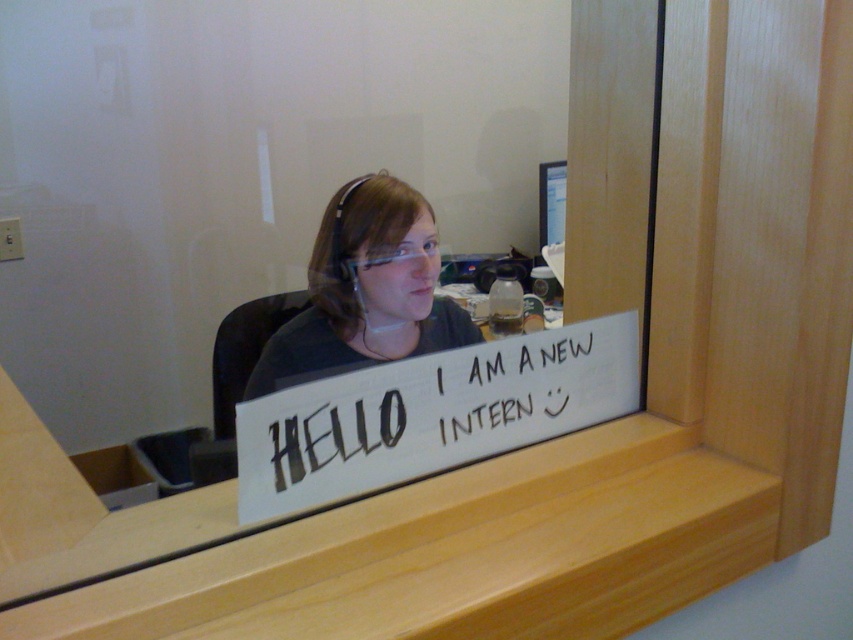
Where is the white paper sign at center located in the image?

The white paper sign at center is located at point (428, 413) in the image.

You are an office manager inspecting the desk of a new intern. You notice the matte black shirt at center and the clear plastic goggles at center on the desk. Which object takes up more horizontal space on the desk?

The matte black shirt at center takes up more horizontal space on the desk because its width is larger than that of the clear plastic goggles at center.

Consider the image. You are an office manager looking at the desk of a new employee. You notice the white paper sign at center and the matte black shirt at center. Which object is shorter?

The white paper sign at center is shorter than the matte black shirt at center.